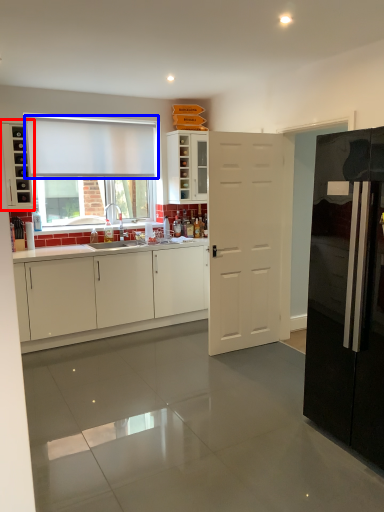
Question: Which point is further to the camera, cabinetry (highlighted by a red box) or curtain (highlighted by a blue box)?

Choices:
 (A) cabinetry
 (B) curtain

Answer: (B)